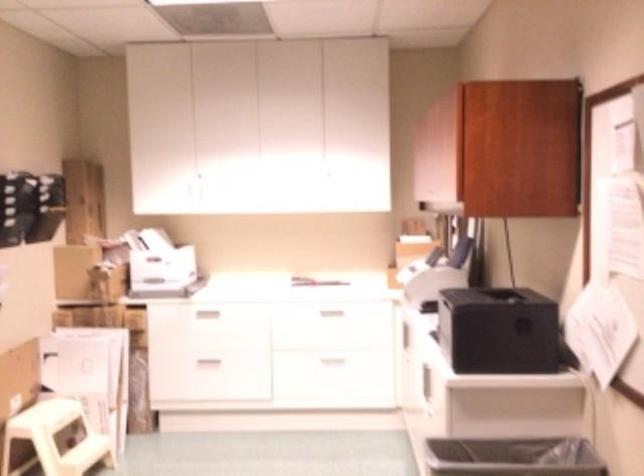
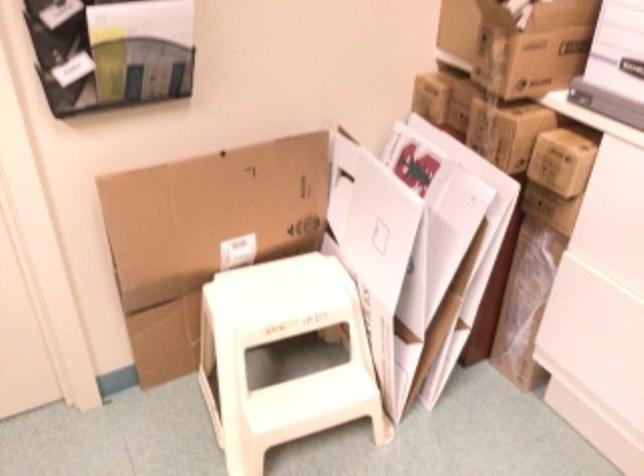
The point at [116,283] is marked in the first image. Where is the corresponding point in the second image?

(532, 46)